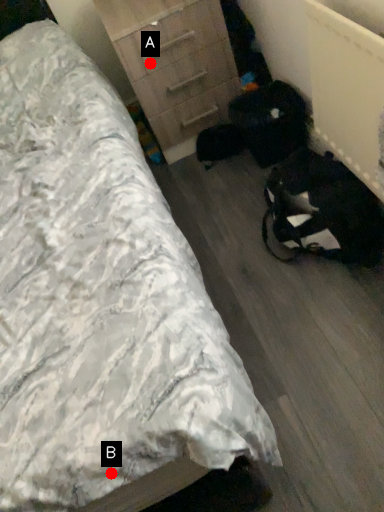
Question: Two points are circled on the image, labeled by A and B beside each circle. Which point is closer to the camera?

Choices:
 (A) A is closer
 (B) B is closer

Answer: (B)